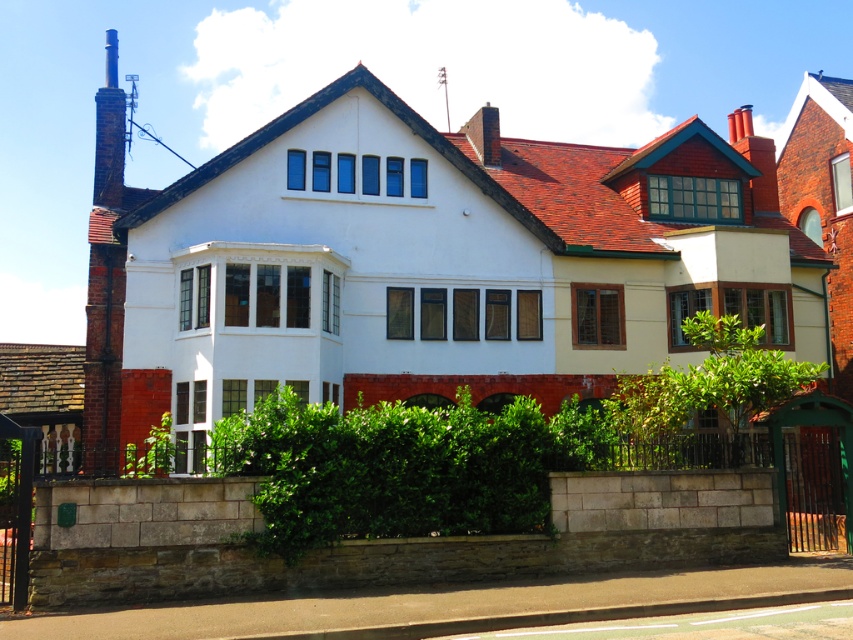
Who is taller, green leafy hedge at center or rusty brick chimney at left?

rusty brick chimney at left

Does green leafy hedge at center come behind rusty brick chimney at left?

No, green leafy hedge at center is in front of rusty brick chimney at left.

Who is more distant from viewer, (289, 490) or (96, 298)?

The point (96, 298) is behind.

In order to click on green leafy hedge at center in this screenshot , I will do `click(386, 468)`.